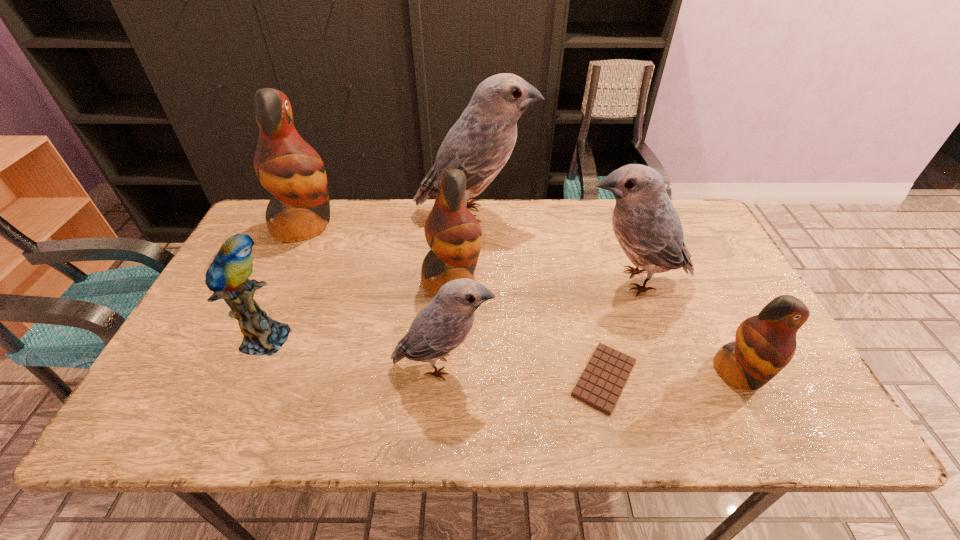
At what (x,y) coordinates should I click in order to perform the action: click on chocolate bar. Please return your answer as a coordinate pair (x, y). The height and width of the screenshot is (540, 960). Looking at the image, I should click on (605, 375).

This screenshot has width=960, height=540. I want to click on brown chocolate bar, so click(605, 375).

Identify the location of blank space located 0.250m on the front-facing side of the farthest gray parrot. This screenshot has height=540, width=960. (609, 214).

This screenshot has height=540, width=960. In order to click on vacant space situated 0.400m on the face of the biggest red parrot in this screenshot , I will do `click(462, 226)`.

The width and height of the screenshot is (960, 540). Identify the location of vacant point located 0.170m on the face of the second biggest red parrot. (542, 280).

Where is `vacant space located on the front-facing side of the second smallest gray parrot`? The width and height of the screenshot is (960, 540). vacant space located on the front-facing side of the second smallest gray parrot is located at coordinates (540, 281).

Identify the location of vacant space located 0.080m on the front-facing side of the second smallest gray parrot. (548, 281).

Locate an element on the screen. vacant space located on the front-facing side of the second smallest gray parrot is located at coordinates (494, 281).

At what (x,y) coordinates should I click in order to perform the action: click on blank space located on the front-facing side of the smallest gray parrot. Please return your answer as a coordinate pair (x, y). Image resolution: width=960 pixels, height=540 pixels. Looking at the image, I should click on (579, 364).

Where is `free space located 0.060m on the face of the rightmost red parrot`? This screenshot has height=540, width=960. free space located 0.060m on the face of the rightmost red parrot is located at coordinates (763, 423).